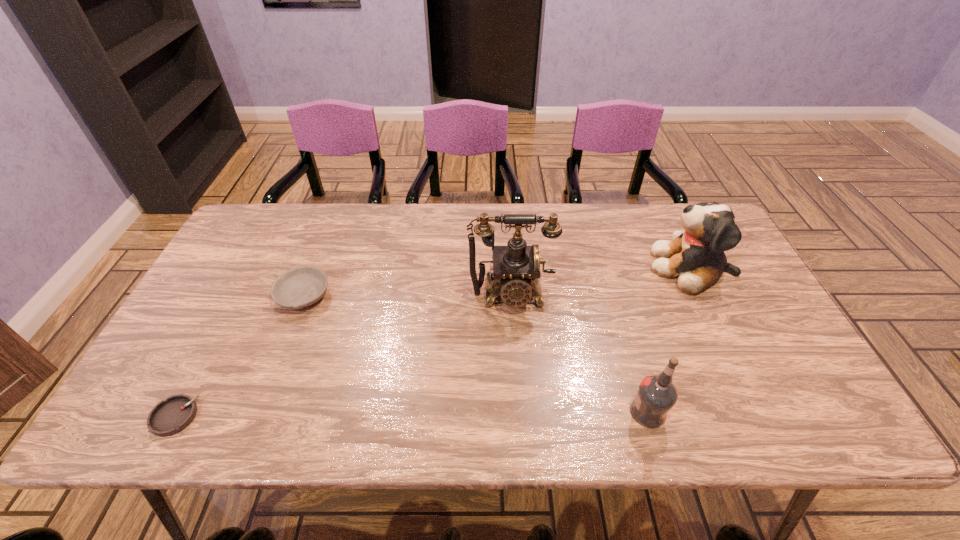
Find the location of `unoccupied position between the tallest object and the fourth object from left to right`. unoccupied position between the tallest object and the fourth object from left to right is located at coordinates (579, 354).

Locate an element on the screen. unoccupied position between the fourth object from left to right and the second object from left to right is located at coordinates (476, 354).

Identify the location of empty space between the leftmost object and the fourth object from left to right. (411, 414).

The image size is (960, 540). I want to click on free spot between the fourth object from right to left and the ashtray, so click(x=239, y=356).

The image size is (960, 540). In order to click on vacant space in between the vodka and the fourth object from right to left in this screenshot , I will do `click(476, 354)`.

The height and width of the screenshot is (540, 960). I want to click on free space between the second shortest object and the leftmost object, so click(239, 356).

In order to click on free space between the vodka and the fourth object from right to left in this screenshot , I will do `click(476, 354)`.

Locate an element on the screen. This screenshot has width=960, height=540. empty location between the second object from right to left and the ashtray is located at coordinates (411, 414).

This screenshot has width=960, height=540. In order to click on vacant space that's between the fourth tallest object and the fourth object from left to right in this screenshot , I will do `click(476, 354)`.

In order to click on object that stands as the second closest to the puppy in this screenshot , I will do `click(656, 396)`.